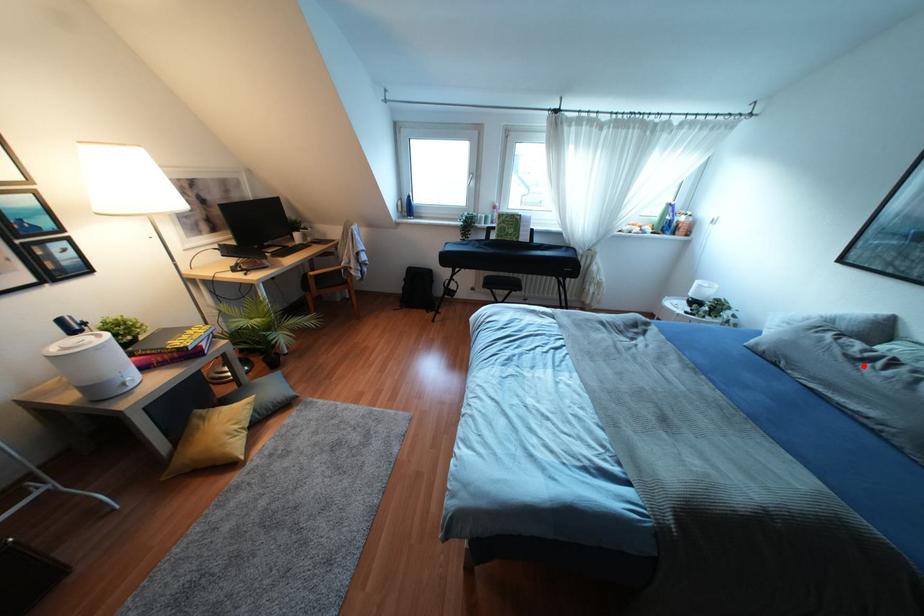
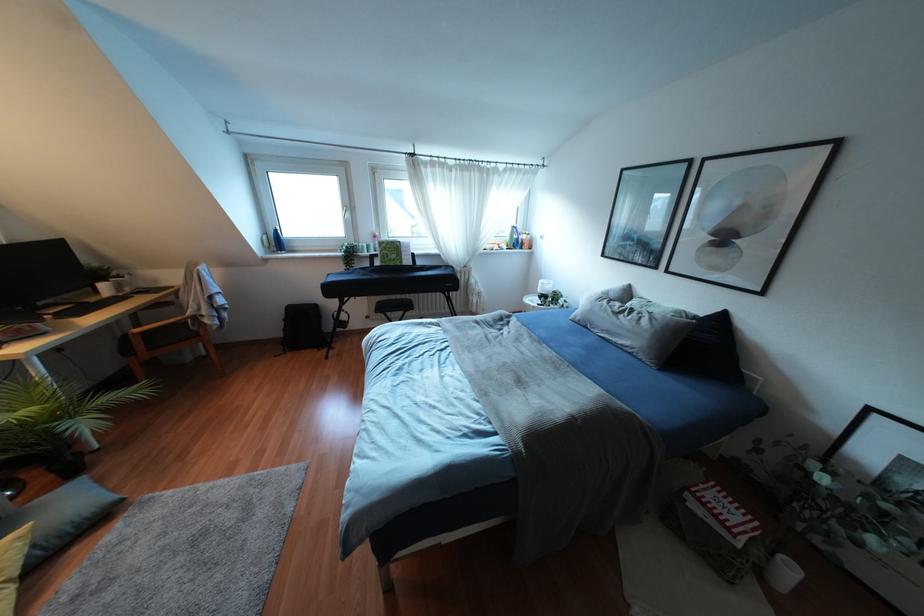
Find the pixel in the second image that matches the highlighted location in the first image.

(619, 315)